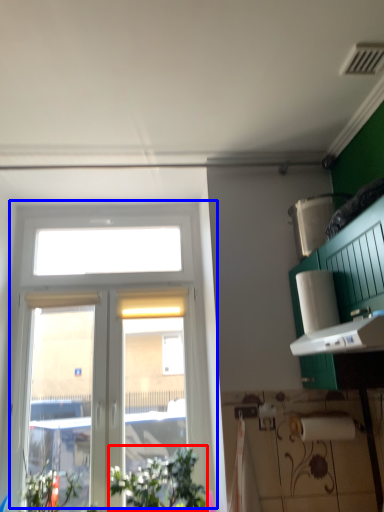
Question: Which object is closer to the camera taking this photo, plant (highlighted by a red box) or window (highlighted by a blue box)?

Choices:
 (A) plant
 (B) window

Answer: (A)